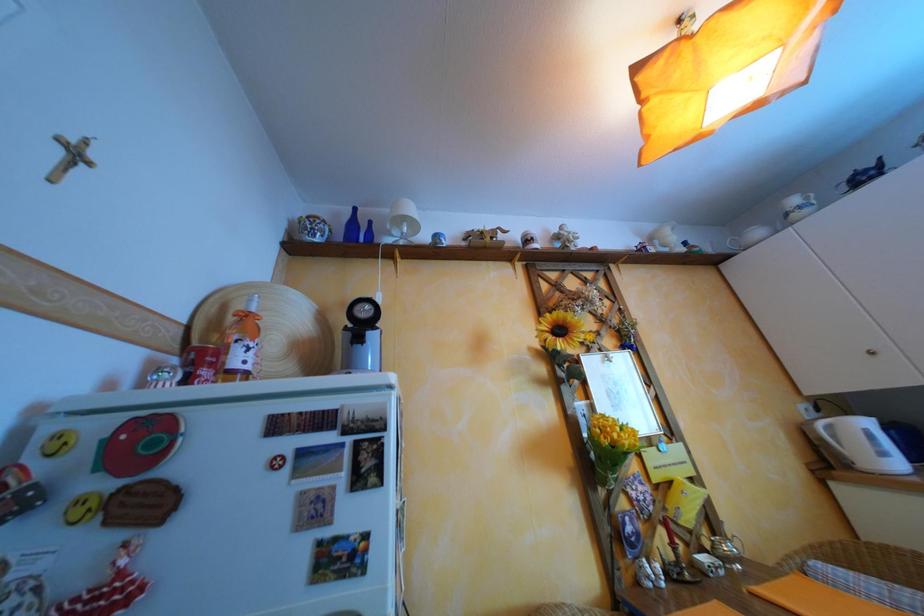
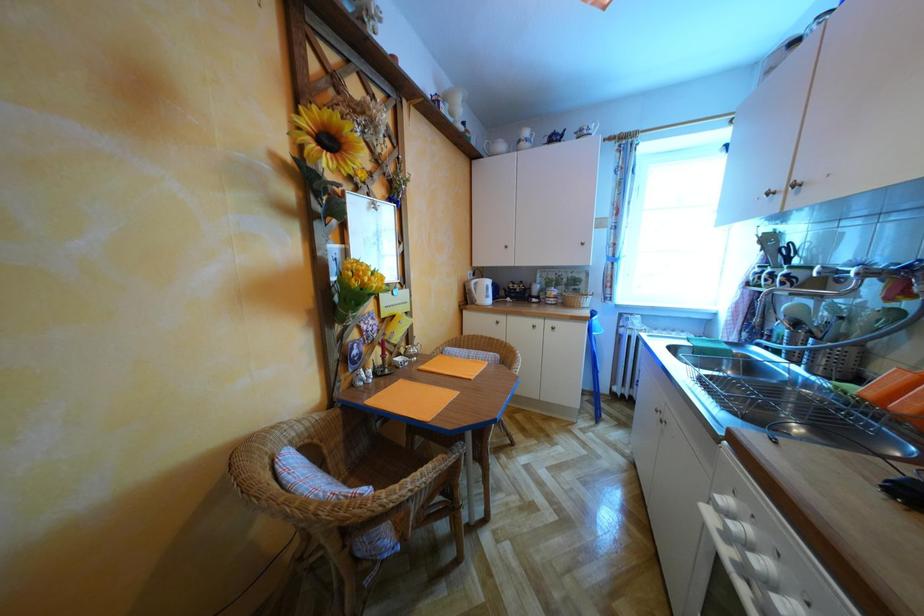
The first image is from the beginning of the video and the second image is from the end. How did the camera likely rotate when shooting the video?

The camera rotated toward right-down.